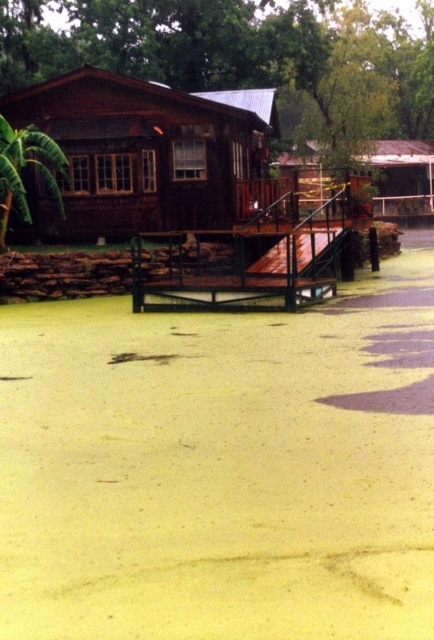
Which is more to the left, green leafy tree at upper center or wooden cabin at center?

Positioned to the left is wooden cabin at center.

Who is shorter, green leafy tree at upper center or wooden cabin at center?

wooden cabin at center is shorter.

This screenshot has height=640, width=434. In order to click on green leafy tree at upper center in this screenshot , I will do point(245,56).

Measure the distance between wooden cabin at center and camera.

wooden cabin at center and camera are 21.95 meters apart.

Is wooden cabin at center smaller than wooden hut at center?

Yes, wooden cabin at center is smaller than wooden hut at center.

Which is behind, point (167, 204) or point (367, 172)?

Positioned behind is point (367, 172).

Find the location of a particular element. This screenshot has height=640, width=434. wooden cabin at center is located at coordinates (144, 152).

Between wooden cabin at center and green leafy tree at left, which one is positioned lower?

Positioned lower is green leafy tree at left.

Is point (117, 163) in front of point (45, 177)?

No.

At what (x,y) coordinates should I click in order to perform the action: click on wooden cabin at center. Please return your answer as a coordinate pair (x, y). Looking at the image, I should click on (144, 152).